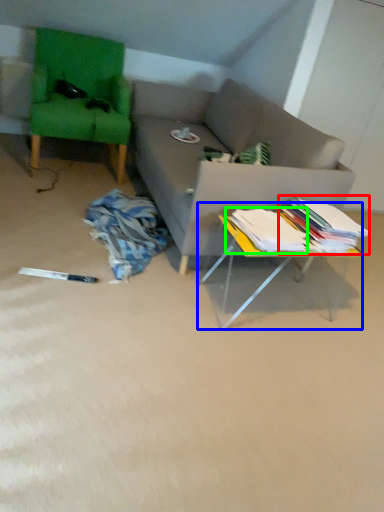
Question: Considering the real-world distances, which object is closest to book (highlighted by a red box)? table (highlighted by a blue box) or book (highlighted by a green box).

Choices:
 (A) table
 (B) book

Answer: (B)